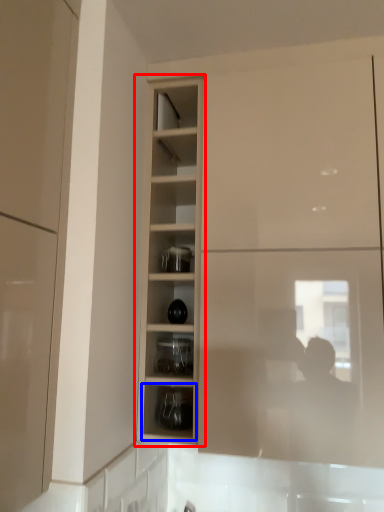
Question: Which point is further to the camera, cupboard (highlighted by a red box) or shelf (highlighted by a blue box)?

Choices:
 (A) cupboard
 (B) shelf

Answer: (B)